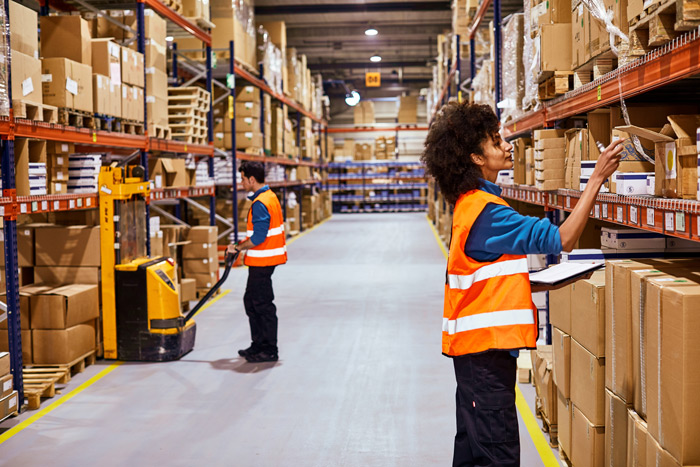
Locate an element on the screen. The width and height of the screenshot is (700, 467). ceiling beams is located at coordinates (314, 8), (316, 24), (321, 43), (323, 59), (354, 78), (392, 76).